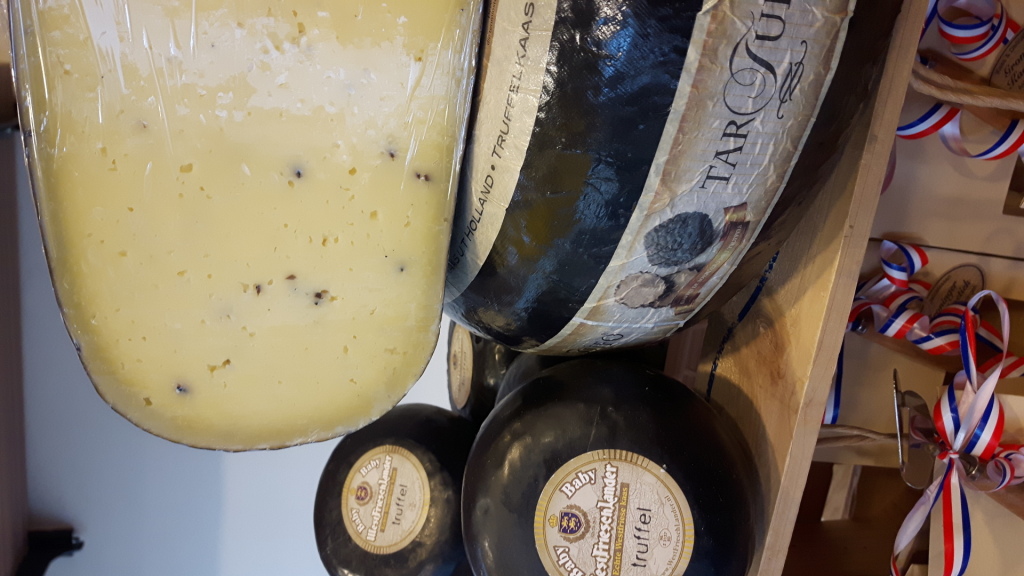
Locate an element on the screen. underside of shelf is located at coordinates (209, 5).